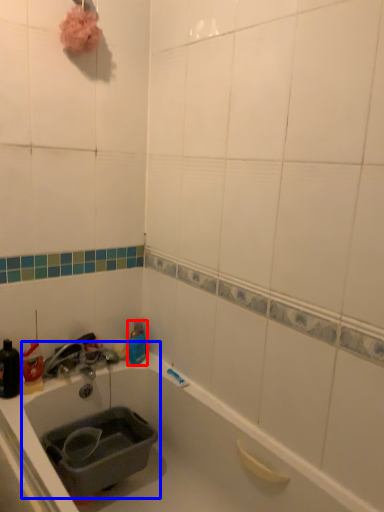
Question: Which point is further to the camera, bottle (highlighted by a red box) or sink (highlighted by a blue box)?

Choices:
 (A) bottle
 (B) sink

Answer: (A)